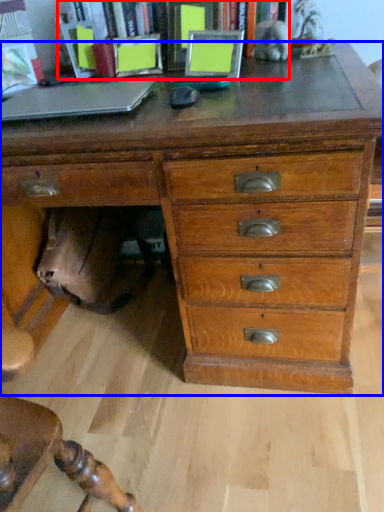
Question: Which object is closer to the camera taking this photo, bookcase (highlighted by a red box) or chest of drawers (highlighted by a blue box)?

Choices:
 (A) bookcase
 (B) chest of drawers

Answer: (B)